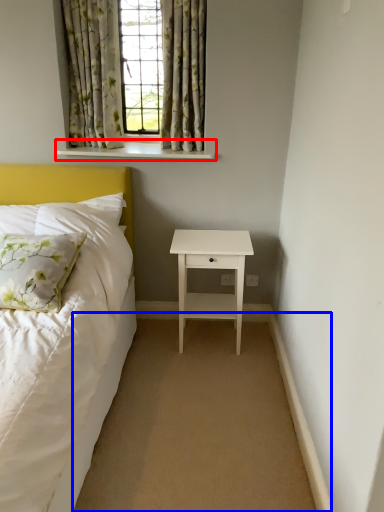
Question: Which point is further to the camera, window sill (highlighted by a red box) or plain (highlighted by a blue box)?

Choices:
 (A) window sill
 (B) plain

Answer: (A)